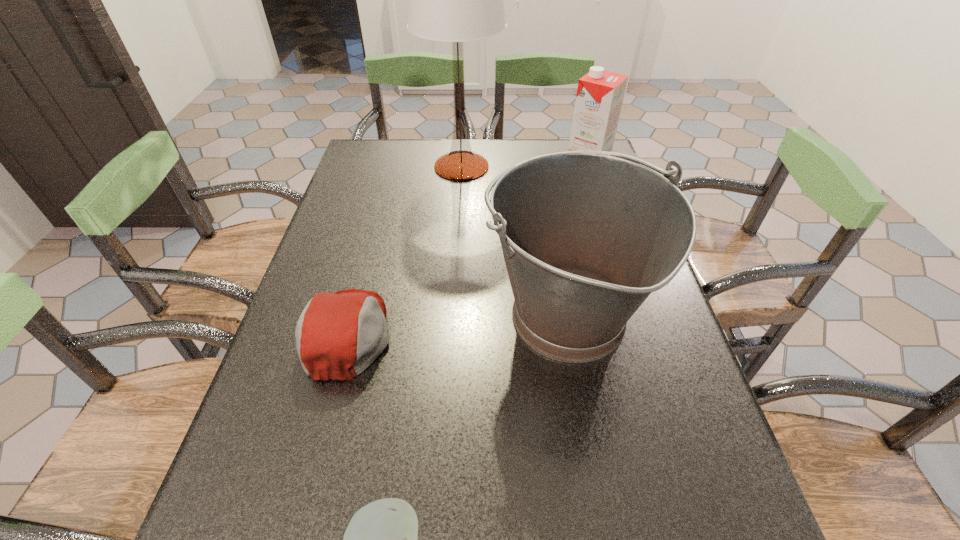
At what (x,y) coordinates should I click in order to perform the action: click on table lamp. Please return your answer as a coordinate pair (x, y). Image resolution: width=960 pixels, height=540 pixels. Looking at the image, I should click on (457, 0).

I want to click on bucket, so [x=587, y=236].

The width and height of the screenshot is (960, 540). I want to click on carton, so click(x=600, y=93).

The width and height of the screenshot is (960, 540). In order to click on the leftmost object in this screenshot , I will do `click(338, 335)`.

The image size is (960, 540). I want to click on vacant region located above the cylindrical shade of the tallest object, so click(x=605, y=167).

The height and width of the screenshot is (540, 960). I want to click on vacant space located 0.240m on the left of the bucket, so click(371, 319).

Image resolution: width=960 pixels, height=540 pixels. I want to click on free space located on the front of the carton, so click(600, 214).

Locate an element on the screen. vacant point located 0.130m on the front-facing side of the cap is located at coordinates (455, 334).

This screenshot has width=960, height=540. Identify the location of table lamp that is at the far edge. (457, 0).

Find the location of a particular element. Image resolution: width=960 pixels, height=540 pixels. carton present at the far edge is located at coordinates (600, 93).